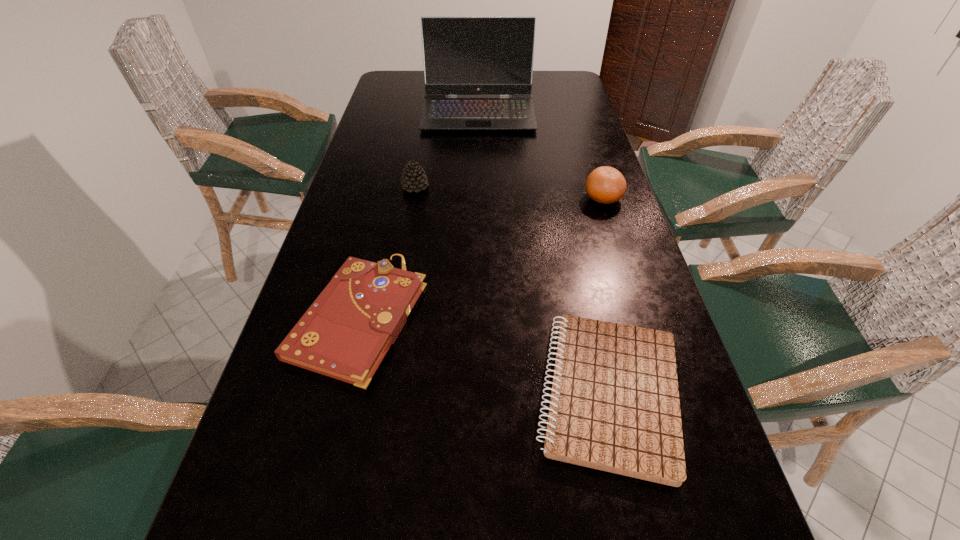
Identify the location of vacant space that satisfies the following two spatial constraints: 1. at the narrow end of the pinecone; 2. on the left side of the clementine. This screenshot has width=960, height=540. (413, 198).

This screenshot has width=960, height=540. I want to click on free spot that satisfies the following two spatial constraints: 1. at the narrow end of the pinecone; 2. on the right side of the shortest object, so pyautogui.click(x=379, y=394).

At what (x,y) coordinates should I click in order to perform the action: click on free space that satisfies the following two spatial constraints: 1. at the narrow end of the shorter notebook; 2. on the left side of the pinecone. Please return your answer as a coordinate pair (x, y). Looking at the image, I should click on (379, 394).